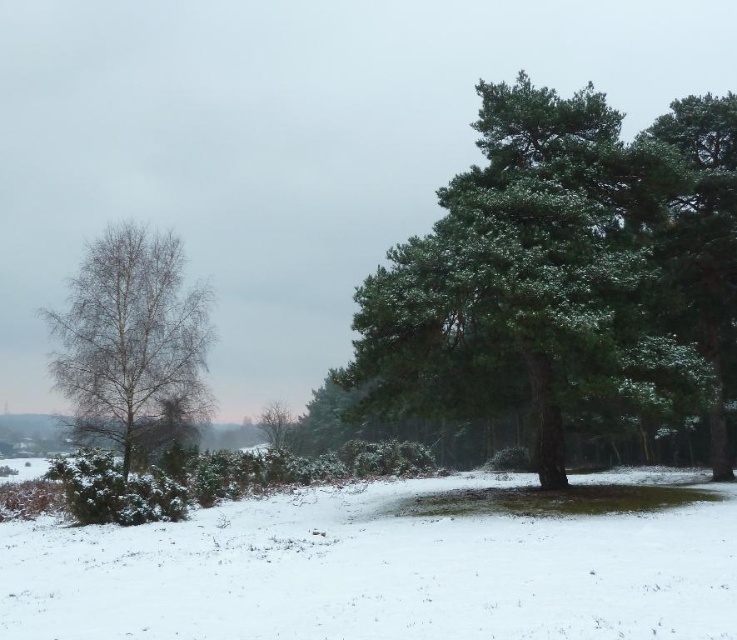
In the scene shown: You are planning to build a snowman using the white fluffy snow at center and the green textured tree at right. Which material would be more suitable for the base of the snowman?

The white fluffy snow at center is thinner than the green textured tree at right, so the green textured tree at right would be more suitable for the base of the snowman since it provides a sturdier foundation.